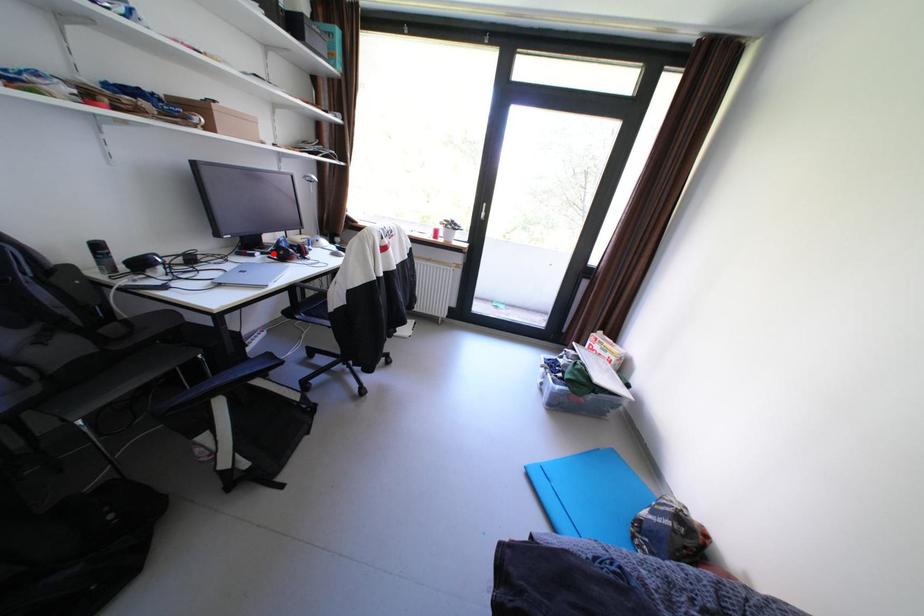
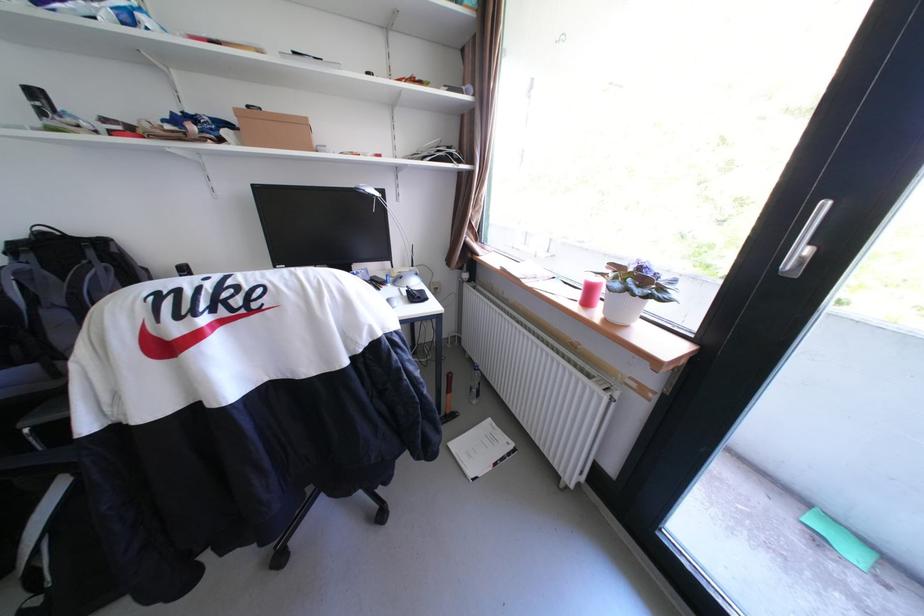
Question: I am providing you with two images of the same scene from different viewpoints. A red point is marked on the first image. Is the red point's position out of view in image 2?

Choices:
 (A) Yes
 (B) No

Answer: (A)